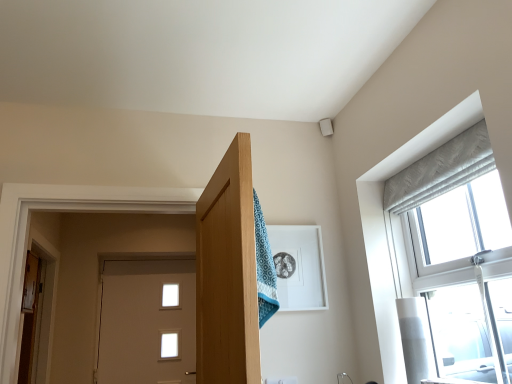
Question: Choose the correct answer: Is white glossy door at center, arranged as the 1th door when viewed from the back, inside wooden door at left, the first door positioned from the left, or outside it?

Choices:
 (A) inside
 (B) outside

Answer: (B)

Question: Is white glossy door at center, which is the 1th door in right-to-left order, bigger or smaller than wooden door at left, the second door positioned from the right?

Choices:
 (A) big
 (B) small

Answer: (A)

Question: Is point (183, 274) closer or farther from the camera than point (31, 370)?

Choices:
 (A) closer
 (B) farther

Answer: (B)

Question: From the image's perspective, is wooden door at left, acting as the second door starting from the back, above or below white glossy door at center, arranged as the 1th door when viewed from the back?

Choices:
 (A) below
 (B) above

Answer: (B)

Question: Choose the correct answer: Is wooden door at left, acting as the second door starting from the back, inside white glossy door at center, which is the 1th door in right-to-left order, or outside it?

Choices:
 (A) inside
 (B) outside

Answer: (B)

Question: Is wooden door at left, the first door positioned from the left, wider or thinner than white glossy door at center, which is the 1th door in right-to-left order?

Choices:
 (A) thin
 (B) wide

Answer: (A)

Question: From a real-world perspective, is wooden door at left, acting as the second door starting from the back, above or below white glossy door at center, which is the 1th door in right-to-left order?

Choices:
 (A) above
 (B) below

Answer: (A)